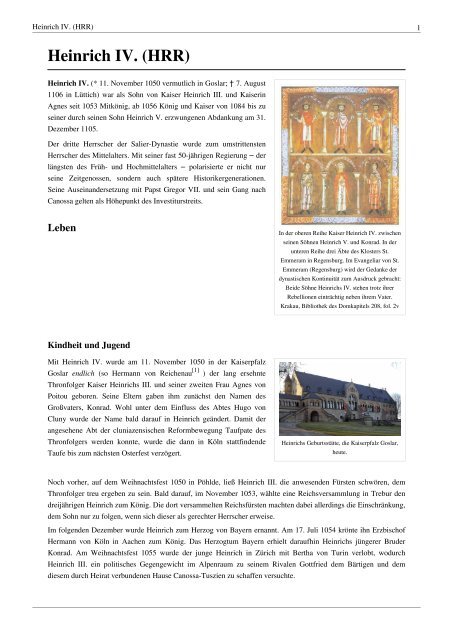
Identify the location of painting. The width and height of the screenshot is (453, 640). (335, 166).